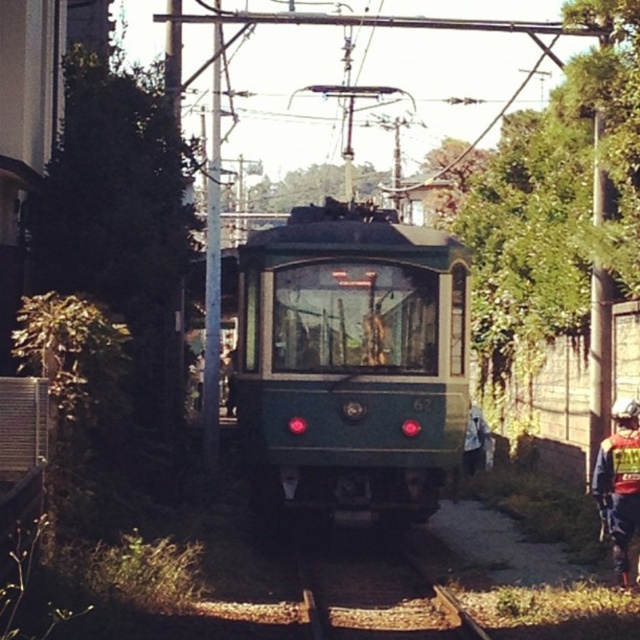
You are a photographer standing near the tracks. You want to take a photo of both the green polished wood train at center and the reflective silver helmet at lower right. Since you have a camera with a fixed focal length, you need to ensure both objects are in frame. Given their sizes, which object should you focus on to include both in the composition?

Since the green polished wood train at center is larger than the reflective silver helmet at lower right, you should focus on the green polished wood train at center to ensure both are in frame.

Consider the image. You are standing on the platform waiting for the tram 62 to arrive. You notice two points marked on the tracks ahead. Which point is closer to you, point (305, 442) or point (630, 496)?

Point (305, 442) is further to the viewer than point (630, 496), so the closer point to you is point (630, 496).